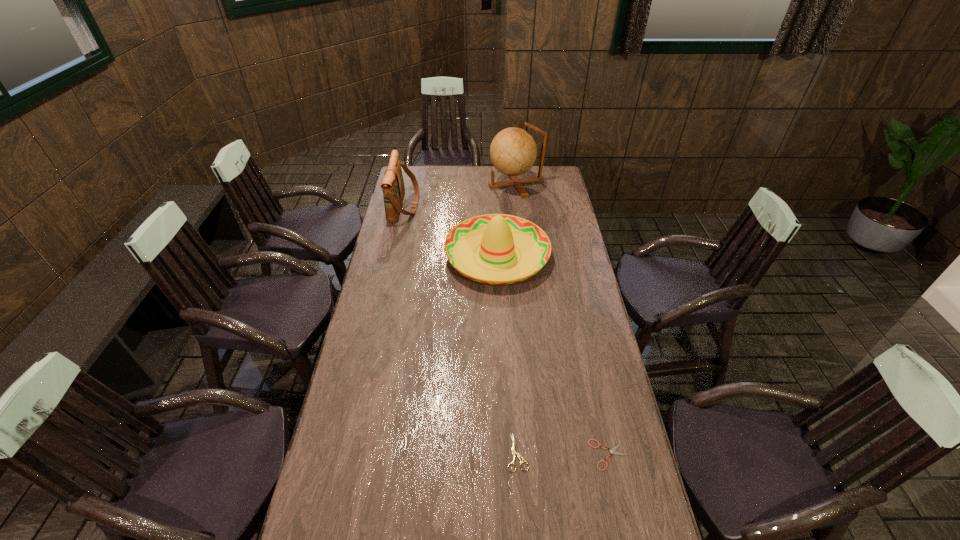
I want to click on vacant region that satisfies the following two spatial constraints: 1. on the front-facing side of the sombrero; 2. on the right side of the leftmost object, so click(x=394, y=255).

This screenshot has width=960, height=540. Identify the location of free space that satisfies the following two spatial constraints: 1. on the surface of the shortest object; 2. on the right side of the tallest object. (547, 455).